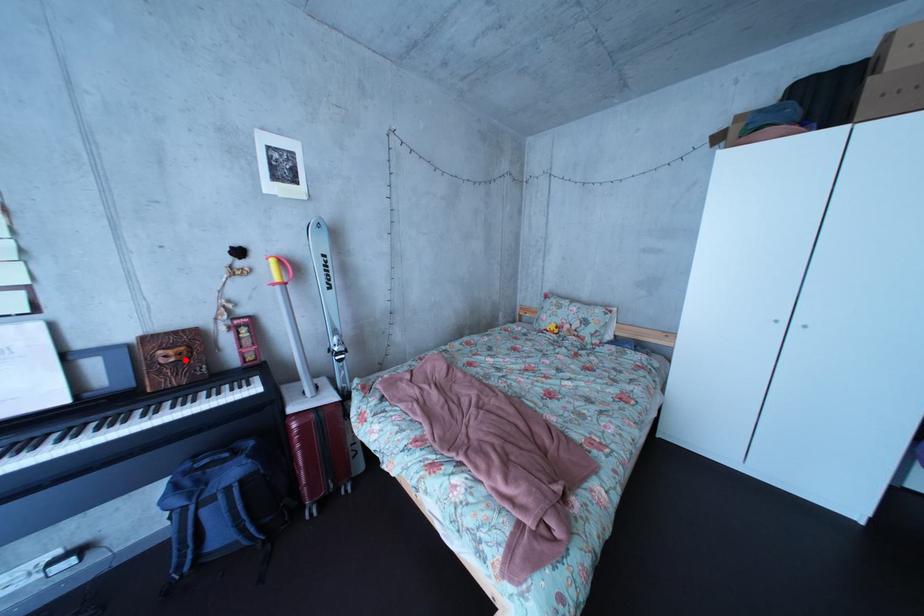
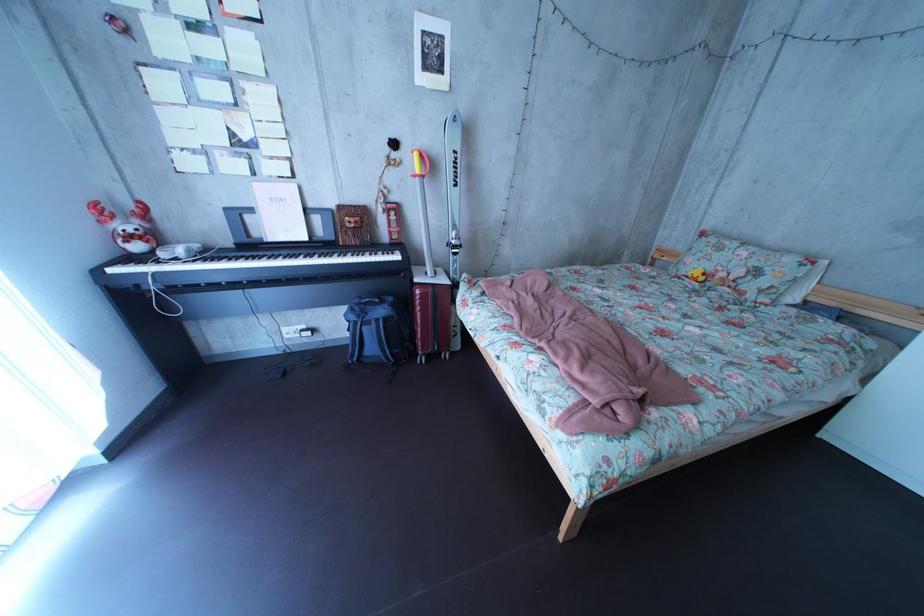
Locate, in the second image, the point that corresponds to the highlighted location in the first image.

(367, 228)